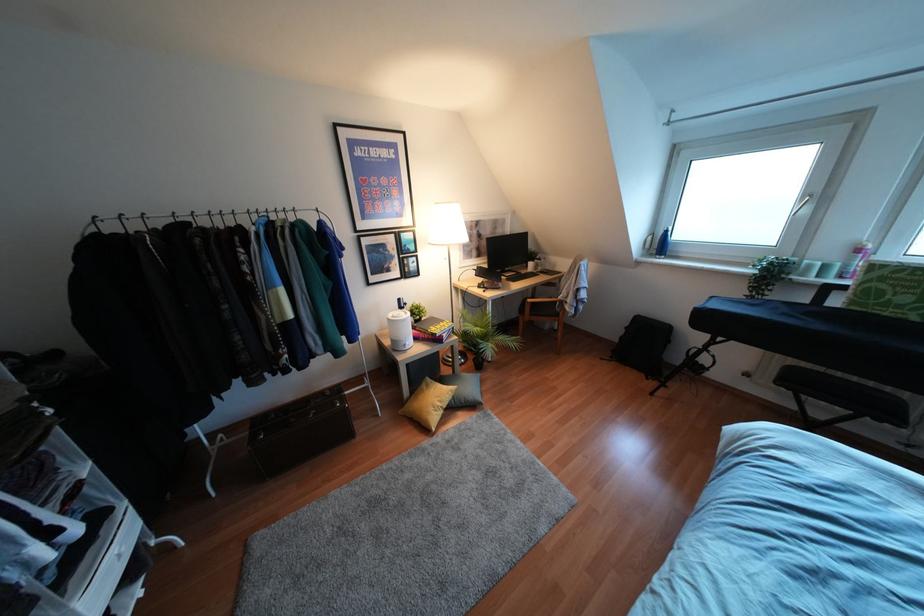
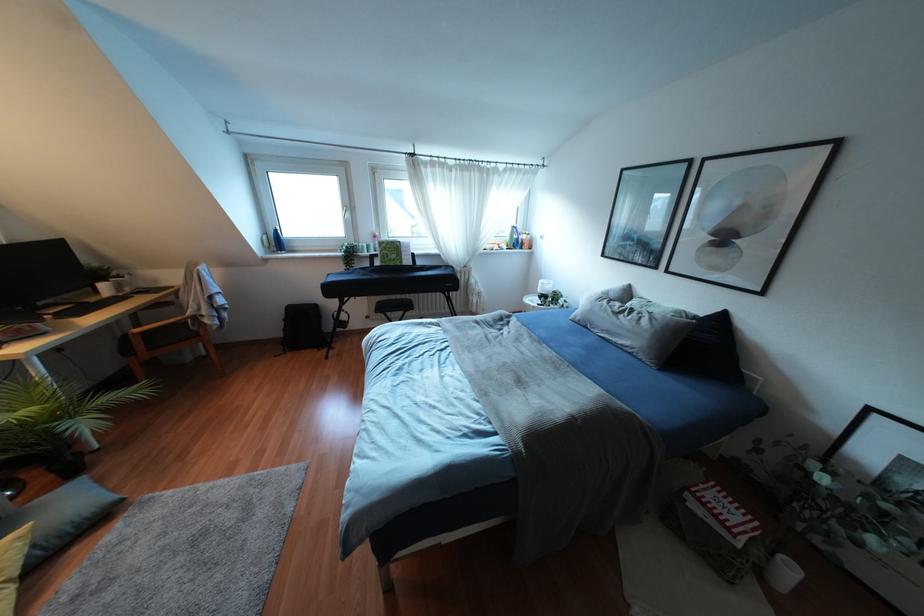
In the second image, find the point that corresponds to point (621, 337) in the first image.

(284, 329)